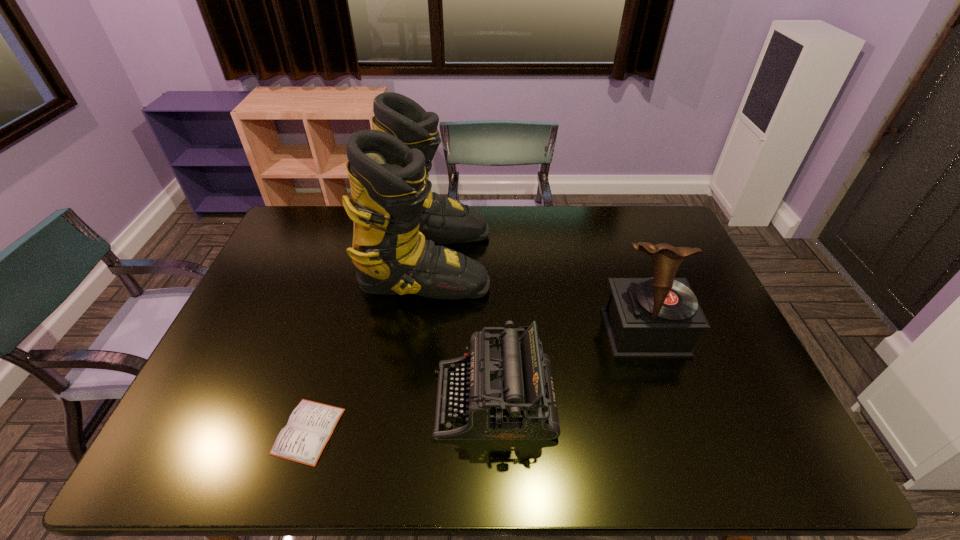
Where is `object that is the second closest to the tallest object`? object that is the second closest to the tallest object is located at coordinates (311, 424).

I want to click on vacant space that satisfies the following two spatial constraints: 1. on the back side of the shortest object; 2. on the right side of the ski boots, so click(360, 261).

Find the location of `vacant region that satisfies the following two spatial constraints: 1. at the horn opening of the phonograph_record; 2. on the keyboard of the typewriter`. vacant region that satisfies the following two spatial constraints: 1. at the horn opening of the phonograph_record; 2. on the keyboard of the typewriter is located at coordinates (668, 400).

Locate an element on the screen. The width and height of the screenshot is (960, 540). free location that satisfies the following two spatial constraints: 1. at the horn opening of the phonograph_record; 2. on the keyboard of the typewriter is located at coordinates (668, 400).

The height and width of the screenshot is (540, 960). I want to click on free space in the image that satisfies the following two spatial constraints: 1. at the horn opening of the phonograph_record; 2. on the keyboard of the second shortest object, so click(x=668, y=400).